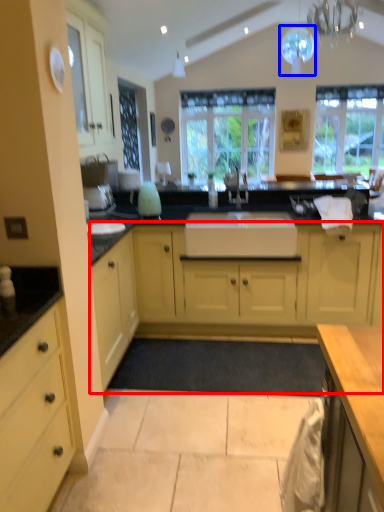
Question: Which object is further to the camera taking this photo, cabinetry (highlighted by a red box) or light fixture (highlighted by a blue box)?

Choices:
 (A) cabinetry
 (B) light fixture

Answer: (B)